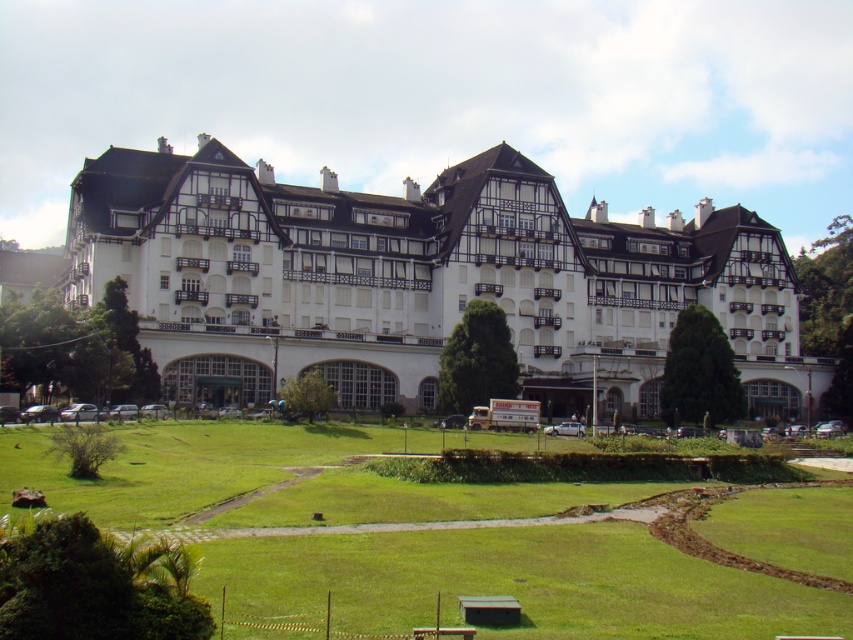
Question: Which of the following is the farthest from the observer?

Choices:
 (A) (163, 513)
 (B) (196, 216)

Answer: (B)

Question: Among these points, which one is farthest from the camera?

Choices:
 (A) (628, 522)
 (B) (370, 230)

Answer: (B)

Question: Is white wooden hotel at center wider than green grass at center?

Choices:
 (A) no
 (B) yes

Answer: (B)

Question: Can you confirm if white wooden hotel at center is positioned below green grass at center?

Choices:
 (A) yes
 (B) no

Answer: (B)

Question: Is white wooden hotel at center smaller than green grass at center?

Choices:
 (A) yes
 (B) no

Answer: (B)